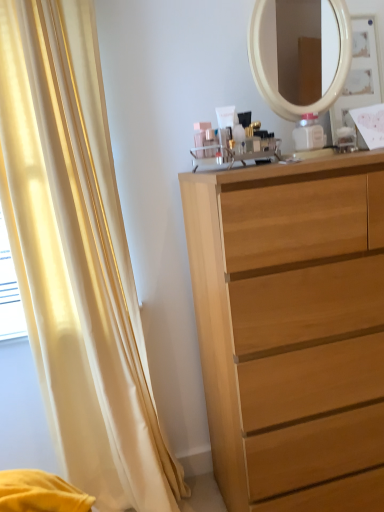
Question: Is light wood chest of drawers at center positioned with its back to silky yellow curtain at left?

Choices:
 (A) yes
 (B) no

Answer: (B)

Question: Does light wood chest of drawers at center appear on the left side of silky yellow curtain at left?

Choices:
 (A) no
 (B) yes

Answer: (A)

Question: Are light wood chest of drawers at center and silky yellow curtain at left beside each other?

Choices:
 (A) no
 (B) yes

Answer: (A)

Question: Can you confirm if light wood chest of drawers at center is shorter than silky yellow curtain at left?

Choices:
 (A) yes
 (B) no

Answer: (A)

Question: Is light wood chest of drawers at center further to the viewer compared to silky yellow curtain at left?

Choices:
 (A) yes
 (B) no

Answer: (B)

Question: Considering the relative sizes of light wood chest of drawers at center and silky yellow curtain at left in the image provided, is light wood chest of drawers at center thinner than silky yellow curtain at left?

Choices:
 (A) no
 (B) yes

Answer: (A)

Question: Is light wood chest of drawers at center a part of silky yellow curtain at left?

Choices:
 (A) no
 (B) yes

Answer: (A)

Question: Is silky yellow curtain at left to the right of light wood chest of drawers at center from the viewer's perspective?

Choices:
 (A) no
 (B) yes

Answer: (A)

Question: Is silky yellow curtain at left turned away from light wood chest of drawers at center?

Choices:
 (A) yes
 (B) no

Answer: (B)

Question: From the image's perspective, would you say silky yellow curtain at left is shown under light wood chest of drawers at center?

Choices:
 (A) yes
 (B) no

Answer: (B)

Question: Considering the relative positions of silky yellow curtain at left and light wood chest of drawers at center in the image provided, is silky yellow curtain at left behind light wood chest of drawers at center?

Choices:
 (A) no
 (B) yes

Answer: (B)

Question: Is the position of silky yellow curtain at left less distant than that of light wood chest of drawers at center?

Choices:
 (A) no
 (B) yes

Answer: (A)

Question: Would you say silky yellow curtain at left is to the left or to the right of light wood chest of drawers at center in the picture?

Choices:
 (A) right
 (B) left

Answer: (B)